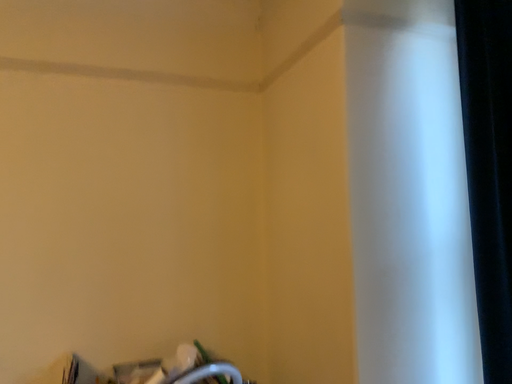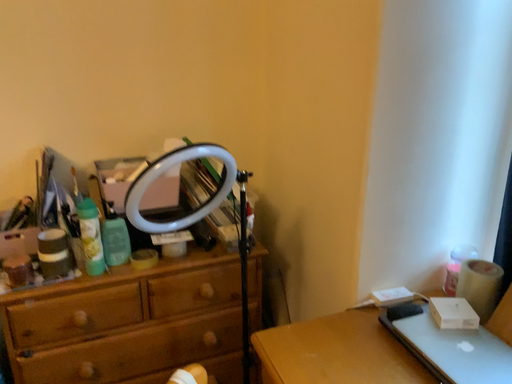
Question: How did the camera likely rotate when shooting the video?

Choices:
 (A) rotated downward
 (B) rotated upward

Answer: (A)